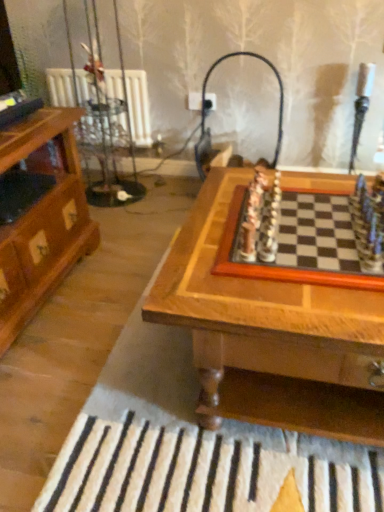
Identify the location of wooden chessboard at center. (270, 335).

Image resolution: width=384 pixels, height=512 pixels. I want to click on wooden chessboard at center, so click(x=270, y=335).

Is wooden chessboard at center facing towards wooden chessboard at center?

No, wooden chessboard at center is not turned towards wooden chessboard at center.

In terms of height, does wooden chessboard at center look taller or shorter compared to wooden chessboard at center?

In the image, wooden chessboard at center appears to be shorter than wooden chessboard at center.

In the image, is wooden chessboard at center positioned in front of or behind wooden chessboard at center?

Clearly, wooden chessboard at center is behind wooden chessboard at center.

Looking at the image, does wooden chessboard at center seem bigger or smaller compared to wooden chessboard at center?

wooden chessboard at center is smaller than wooden chessboard at center.

Considering the relative sizes of wooden chessboard at center and matte black lamp at upper center in the image provided, is wooden chessboard at center shorter than matte black lamp at upper center?

Yes.

Is wooden chessboard at center positioned with its back to matte black lamp at upper center?

No, matte black lamp at upper center is not at the back of wooden chessboard at center.

From a real-world perspective, is wooden chessboard at center under matte black lamp at upper center?

No, from a real-world perspective, wooden chessboard at center is not below matte black lamp at upper center.

The width and height of the screenshot is (384, 512). Find the location of `lamp below the wooden chessboard at center (from a real-world perspective)`. lamp below the wooden chessboard at center (from a real-world perspective) is located at coordinates (209, 106).

Does matte black lamp at upper center have a larger size compared to wooden chessboard at center?

Yes, matte black lamp at upper center is bigger than wooden chessboard at center.

Which is more to the left, matte black lamp at upper center or wooden chessboard at center?

matte black lamp at upper center.

In terms of size, does matte black lamp at upper center appear bigger or smaller than wooden chessboard at center?

Clearly, matte black lamp at upper center is smaller in size than wooden chessboard at center.

Between point (224, 59) and point (219, 396), which one is positioned in front?

Positioned in front is point (219, 396).

Are matte black lamp at upper center and wooden chessboard at center beside each other?

They are not placed beside each other.

In order to click on lamp above the wooden chessboard at center (from the image's perspective) in this screenshot , I will do `click(209, 106)`.

From the image's perspective, between wooden chessboard at center and matte black lamp at upper center, which one is located above?

matte black lamp at upper center is shown above in the image.

Considering the sizes of objects wooden chessboard at center and matte black lamp at upper center in the image provided, who is shorter, wooden chessboard at center or matte black lamp at upper center?

With less height is wooden chessboard at center.

Is wooden chessboard at center oriented away from matte black lamp at upper center?

Yes.

Consider the image. From a real-world perspective, which is physically above, wooden chessboard at center or matte black lamp at upper center?

matte black lamp at upper center is physically above.

Is wooden chessboard at center directly adjacent to wooden chessboard at center?

No, wooden chessboard at center is not with wooden chessboard at center.

Considering the sizes of objects wooden chessboard at center and wooden chessboard at center in the image provided, who is smaller, wooden chessboard at center or wooden chessboard at center?

Smaller between the two is wooden chessboard at center.

Does wooden chessboard at center turn towards wooden chessboard at center?

No, wooden chessboard at center is not facing towards wooden chessboard at center.

Is wooden chessboard at center at the left side of wooden chessboard at center?

Yes.

The image size is (384, 512). In order to click on board game to the right of wooden chessboard at center in this screenshot , I will do `click(304, 236)`.

Locate an element on the screen. This screenshot has width=384, height=512. lamp above the wooden chessboard at center (from the image's perspective) is located at coordinates (209, 106).

Estimate the real-world distances between objects in this image. Which object is further from matte black lamp at upper center, wooden chessboard at center or wooden chessboard at center?

Among the two, wooden chessboard at center is located further to matte black lamp at upper center.

Based on their spatial positions, is matte black lamp at upper center or wooden chessboard at center closer to wooden chessboard at center?

wooden chessboard at center lies closer to wooden chessboard at center than the other object.

Looking at this image, which object lies nearer to the anchor point wooden chessboard at center, matte black lamp at upper center or wooden chessboard at center?

Among the two, wooden chessboard at center is located nearer to wooden chessboard at center.

When comparing their distances from wooden chessboard at center, does wooden chessboard at center or matte black lamp at upper center seem closer?

wooden chessboard at center is closer to wooden chessboard at center.

Based on their spatial positions, is wooden chessboard at center or matte black lamp at upper center closer to wooden chessboard at center?

wooden chessboard at center is closer to wooden chessboard at center.

Based on their spatial positions, is wooden chessboard at center or wooden chessboard at center closer to matte black lamp at upper center?

wooden chessboard at center is positioned closer to the anchor matte black lamp at upper center.

I want to click on board game located between wooden chessboard at center and matte black lamp at upper center in the depth direction, so click(x=304, y=236).